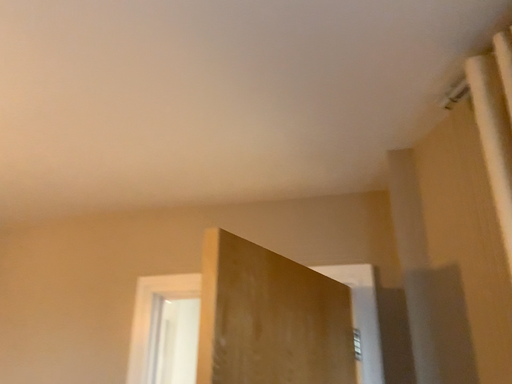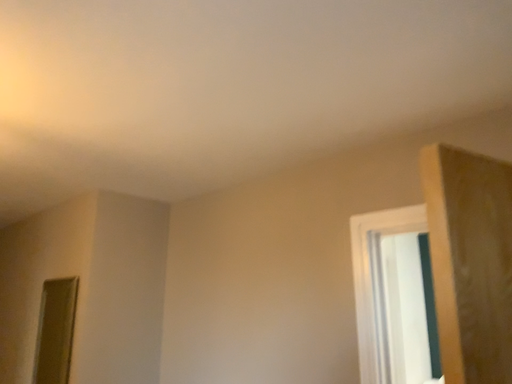
Question: Which way did the camera rotate in the video?

Choices:
 (A) rotated downward
 (B) rotated upward

Answer: (A)